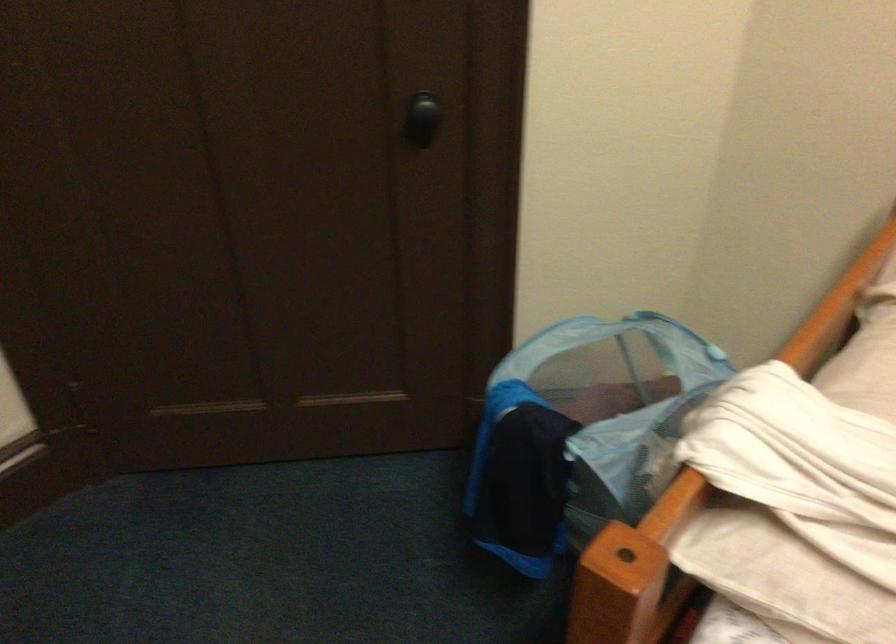
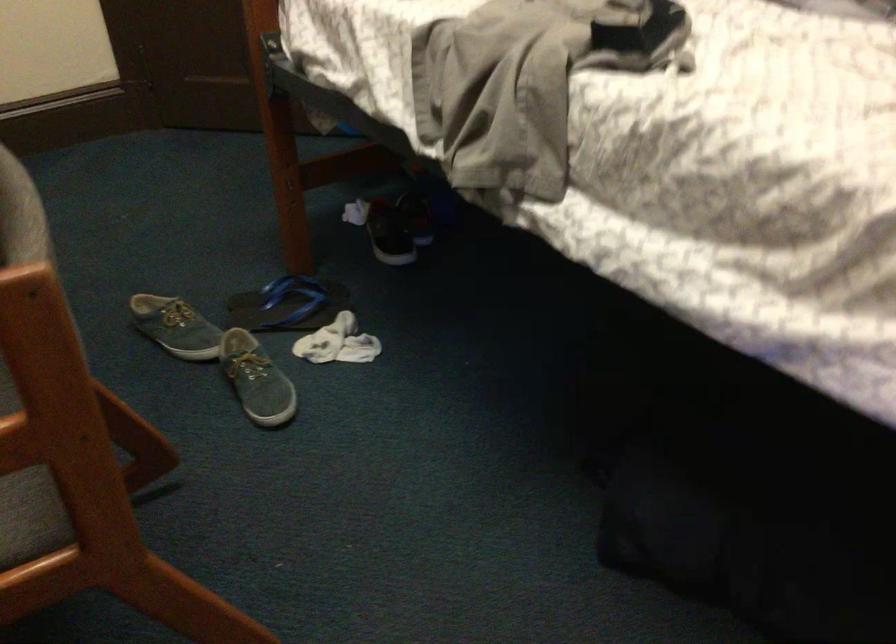
In a continuous first-person perspective shot, in which direction is the camera moving?

The cameraman walked toward right, backward.